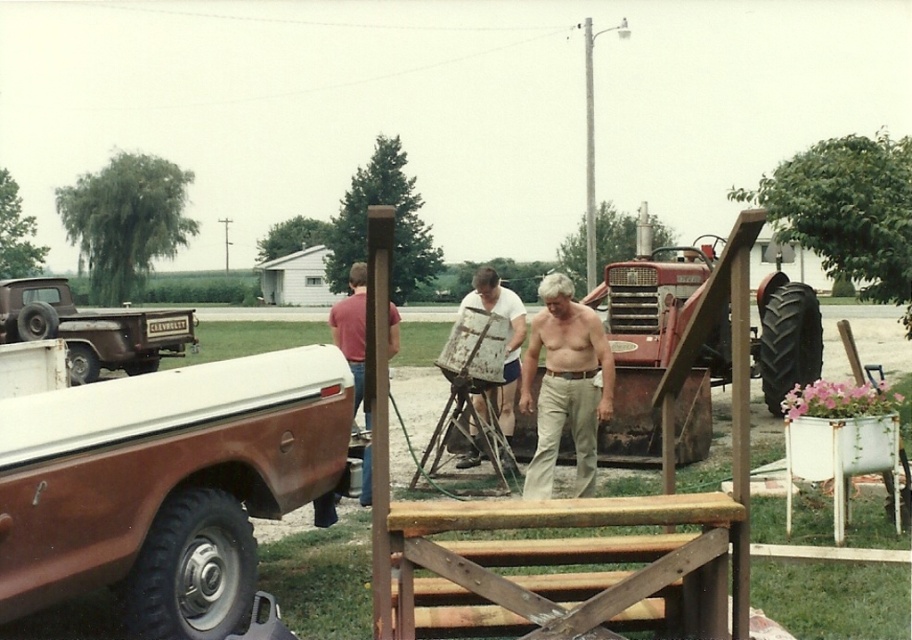
Consider the image. You are standing in the rural outdoor scene and need to determine which object is taller between the rusty brown truck at left and the matte red shirt at center. Based on the scene description, which one is taller?

The matte red shirt at center is taller than the rusty brown truck at left.